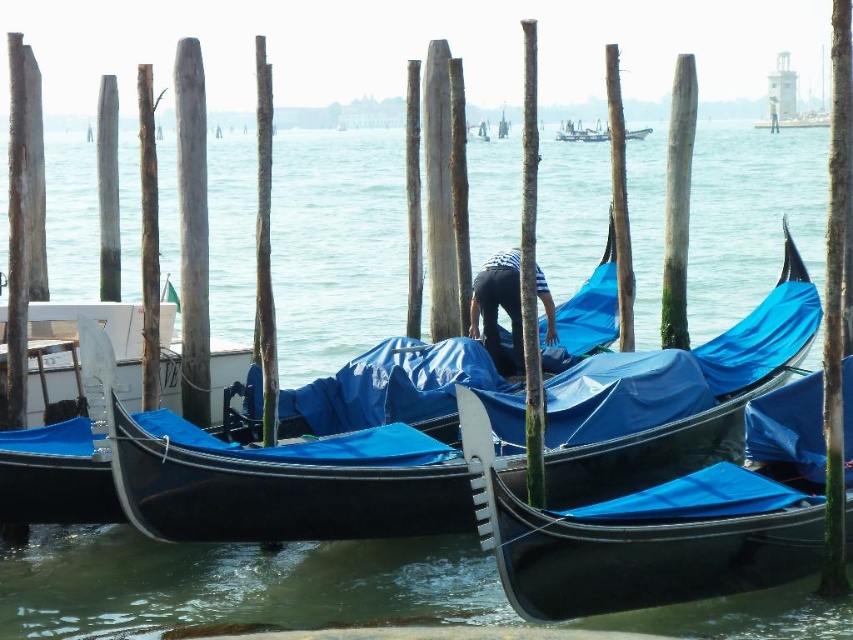
Does blue tarpaulin canoe at center lie behind blue tarpaulin boat at center?

That is False.

Can you confirm if blue tarpaulin canoe at center is positioned below blue tarpaulin boat at center?

Yes.

Is point (78, 404) positioned before point (606, 136)?

Yes, point (78, 404) is in front of point (606, 136).

At what (x,y) coordinates should I click in order to perform the action: click on blue tarpaulin canoe at center. Please return your answer as a coordinate pair (x, y). This screenshot has height=640, width=853. Looking at the image, I should click on (67, 420).

Who is more distant from viewer, (717, 589) or (16, 458)?

Point (16, 458)

What do you see at coordinates (663, 520) in the screenshot? I see `shiny blue gondola at center` at bounding box center [663, 520].

Find the location of a particular element. The height and width of the screenshot is (640, 853). shiny blue gondola at center is located at coordinates point(663,520).

The width and height of the screenshot is (853, 640). Find the location of `shiny blue gondola at center`. shiny blue gondola at center is located at coordinates (663, 520).

Can you confirm if shiny blue gondola at center is positioned above blue tarpaulin boat at center?

No, shiny blue gondola at center is not above blue tarpaulin boat at center.

In the scene shown: Is shiny blue gondola at center positioned at the back of blue tarpaulin boat at center?

No, shiny blue gondola at center is closer to the viewer.

The height and width of the screenshot is (640, 853). I want to click on shiny blue gondola at center, so click(663, 520).